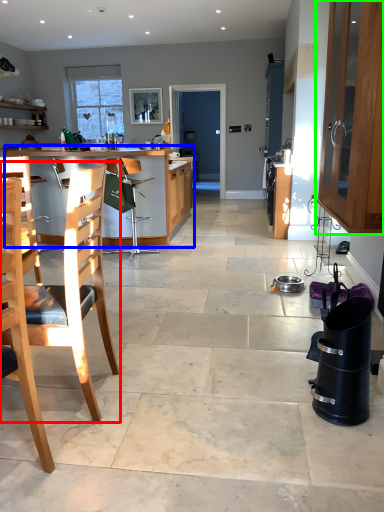
Question: Which object is positioned farthest from chair (highlighted by a red box)? Select from kitchen & dining room table (highlighted by a blue box) and cabinetry (highlighted by a green box).

Choices:
 (A) kitchen & dining room table
 (B) cabinetry

Answer: (A)